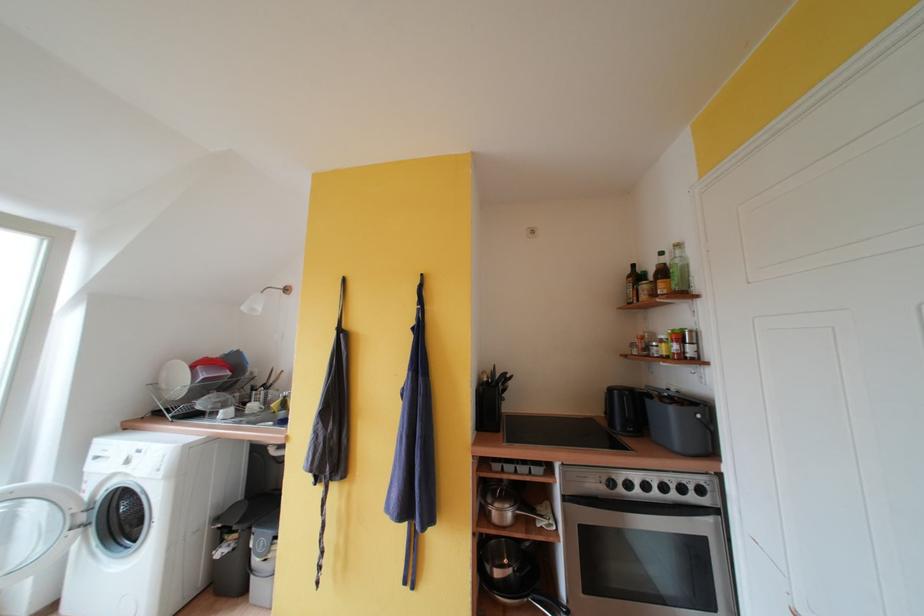
Locate an element on the screen. The height and width of the screenshot is (616, 924). knife handle is located at coordinates (576, 435).